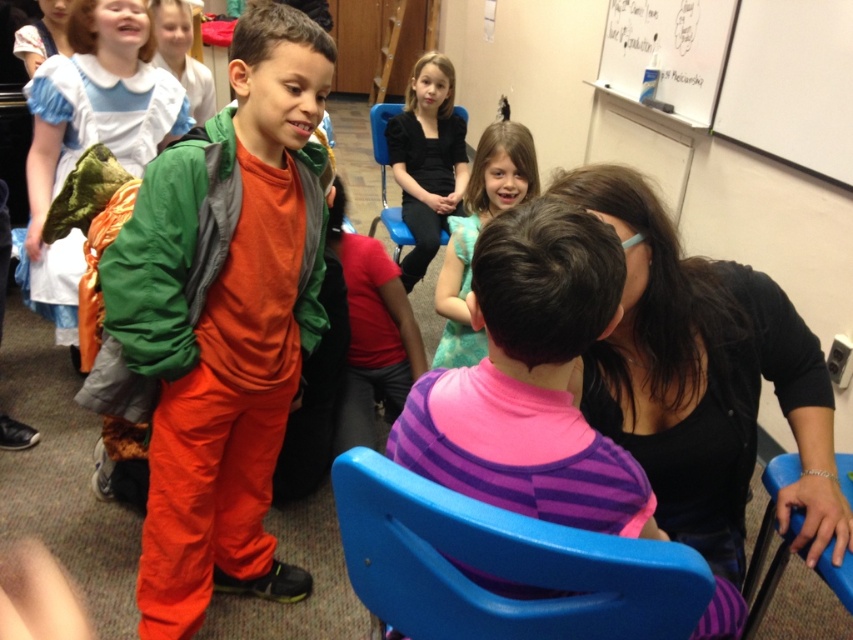
You are organizing a small group activity in this classroom. You need to place a 20 cm wide book between the black matte shirt at center and the blue plastic chair at lower right. Is there enough space?

The distance between the black matte shirt at center and the blue plastic chair at lower right is 21.52 centimeters. Since the book is only 20 cm wide, there is enough space to place it between them.

You are a visitor entering the room and want to place a small plant on the floor between the white matte board at upper right and the blue plastic chair at lower right. Is there enough space for the plant?

The white matte board at upper right is above the blue plastic chair at lower right, so the vertical distance between them may not provide enough horizontal space for placing a plant on the floor. Check the horizontal clearance before placing the plant.